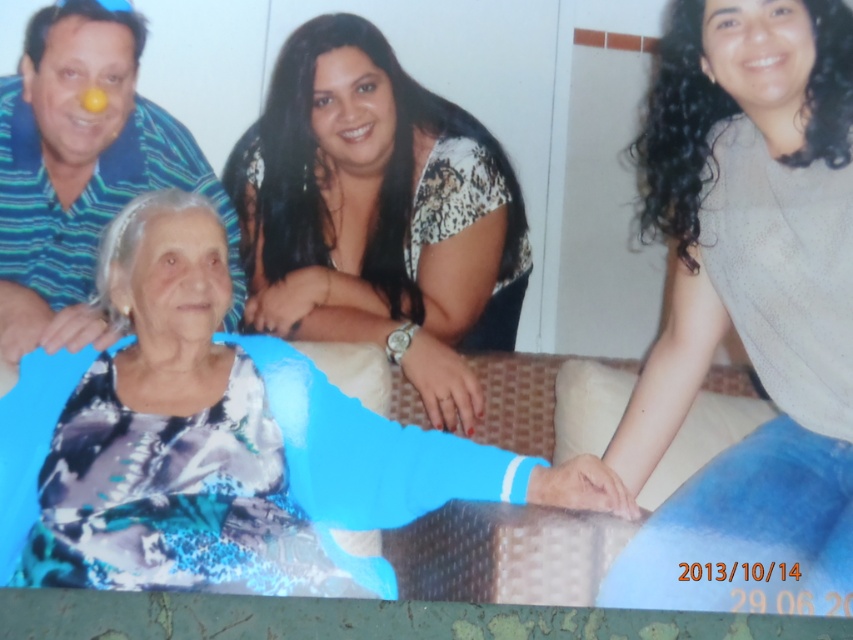
Question: Which of these objects is positioned closest to the blue striped shirt at upper left?

Choices:
 (A) printed fabric blouse at center
 (B) blue textured sweater at center

Answer: (A)

Question: Among these objects, which one is nearest to the camera?

Choices:
 (A) blue printed dress at lower left
 (B) blue striped shirt at upper left

Answer: (A)

Question: Does blue printed dress at lower left appear on the left side of blue textured sweater at center?

Choices:
 (A) no
 (B) yes

Answer: (B)

Question: Can you confirm if blue printed dress at lower left is wider than blue striped shirt at upper left?

Choices:
 (A) no
 (B) yes

Answer: (B)

Question: Is blue printed dress at lower left below blue striped shirt at upper left?

Choices:
 (A) no
 (B) yes

Answer: (B)

Question: Estimate the real-world distances between objects in this image. Which object is farther from the blue textured sweater at center?

Choices:
 (A) blue printed dress at lower left
 (B) blue striped shirt at upper left

Answer: (B)